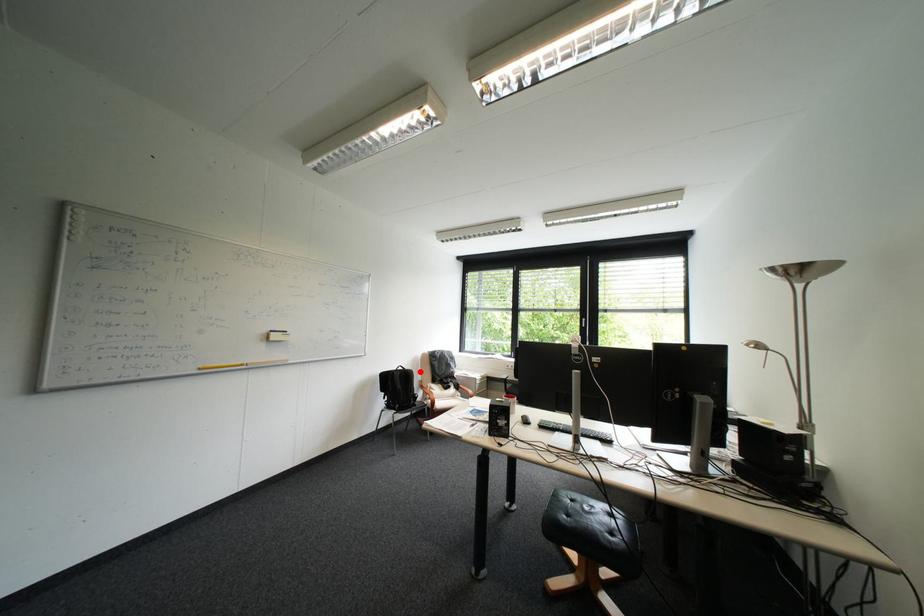
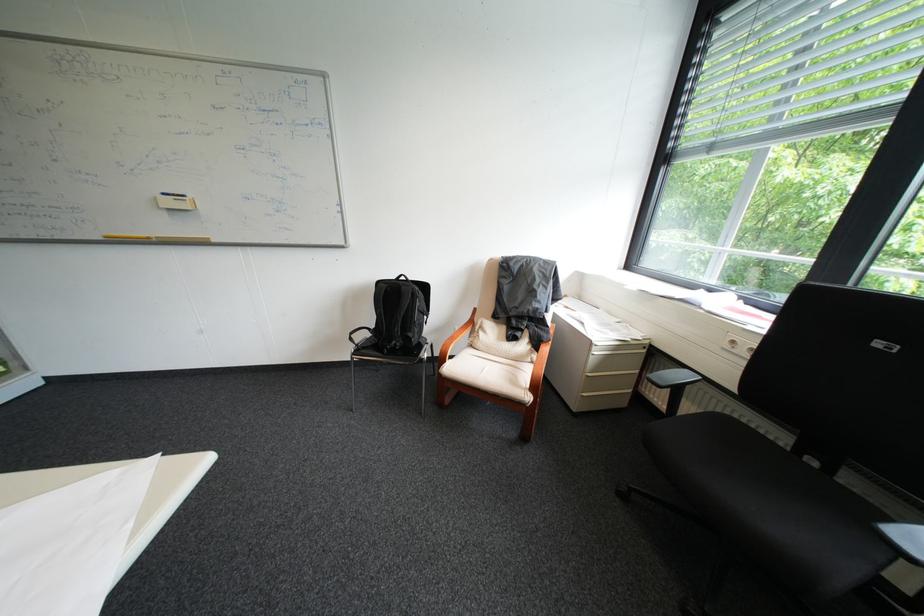
Locate, in the second image, the point that corresponds to the highlighted location in the first image.

(415, 288)